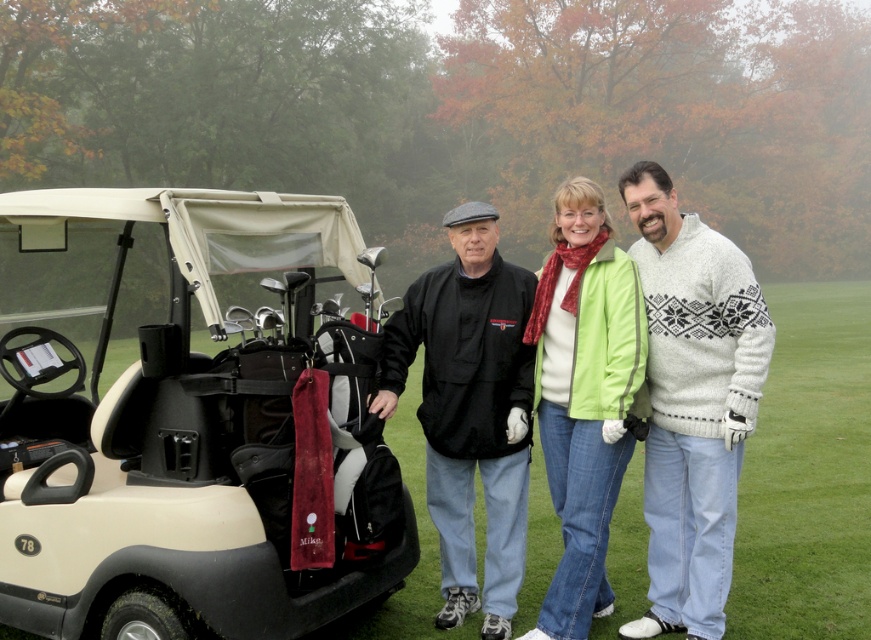
Does beige matte golf cart at left appear under green fabric jacket at center?

No.

Between beige matte golf cart at left and green fabric jacket at center, which one is positioned higher?

beige matte golf cart at left is above.

What are the coordinates of `beige matte golf cart at left` in the screenshot? It's located at (179, 422).

Locate an element on the screen. beige matte golf cart at left is located at coordinates (179, 422).

In the scene shown: Does black matte jacket at center appear on the right side of green matte jacket at center?

Incorrect, black matte jacket at center is not on the right side of green matte jacket at center.

Is black matte jacket at center to the left of green matte jacket at center from the viewer's perspective?

Yes, black matte jacket at center is to the left of green matte jacket at center.

Locate an element on the screen. This screenshot has height=640, width=871. black matte jacket at center is located at coordinates (470, 410).

Between beige matte golf cart at left and green matte jacket at center, which one appears on the right side from the viewer's perspective?

green matte jacket at center

Is beige matte golf cart at left smaller than green matte jacket at center?

No.

Is point (71, 630) positioned before point (604, 305)?

Yes, point (71, 630) is in front of point (604, 305).

This screenshot has width=871, height=640. In order to click on beige matte golf cart at left in this screenshot , I will do `click(179, 422)`.